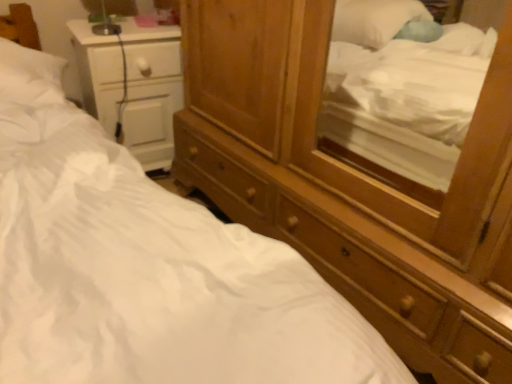
Where is `vacant area on top of white glossy nightstand at left (from a real-world perspective)`? Image resolution: width=512 pixels, height=384 pixels. vacant area on top of white glossy nightstand at left (from a real-world perspective) is located at coordinates pos(125,24).